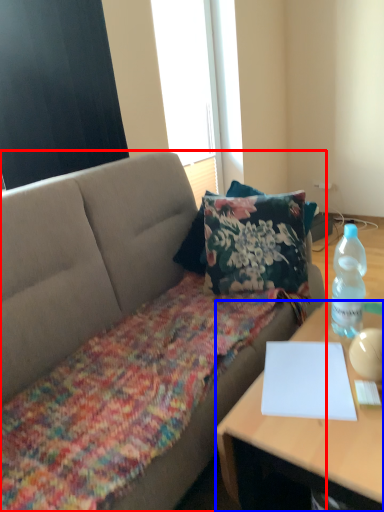
Question: Among these objects, which one is nearest to the camera, studio couch (highlighted by a red box) or desk (highlighted by a blue box)?

Choices:
 (A) studio couch
 (B) desk

Answer: (A)